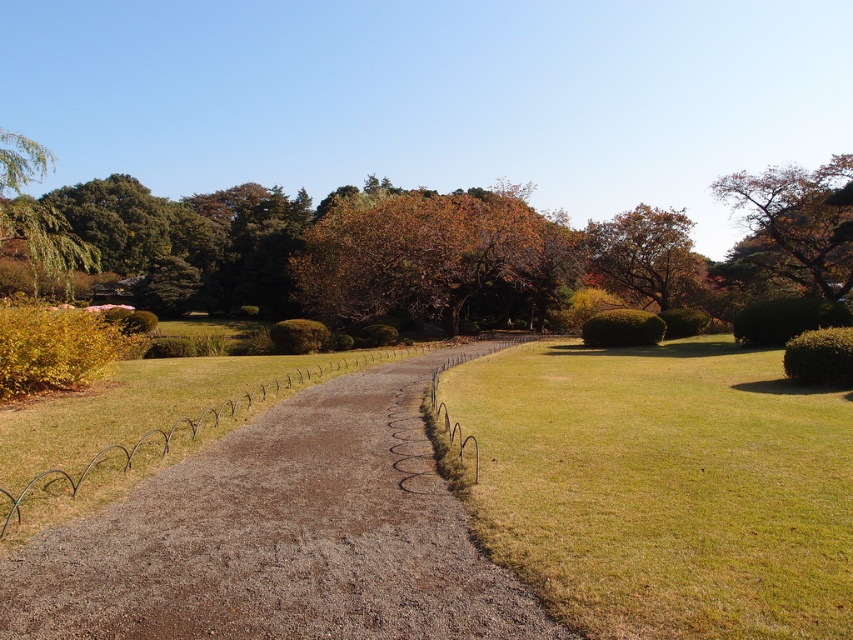
You are standing at the entrance of the park and want to locate the brown leafy tree at center. Based on the coordinates provided, in which direction should you walk to find it?

The brown leafy tree at center is located at coordinates point [428,253]. Since the coordinate system typically places the origin at the bottom left corner, the tree is positioned slightly to the right and above the center point of the image. Therefore, you should walk forward and slightly to the right from the entrance to reach it.

You are a gardener planning to water the green leafy hedge at right and the green leafy bush at center. Which one should you water first if you want to start from the left side of the park?

You should water the green leafy bush at center first because it is located to the left of the green leafy hedge at right.

You are a gardener who needs to trim both the green leafy hedge at right and the green leafy bush at center. Which one will require more time and effort due to its size?

The green leafy hedge at right will require more time and effort because it is larger in size than the green leafy bush at center.